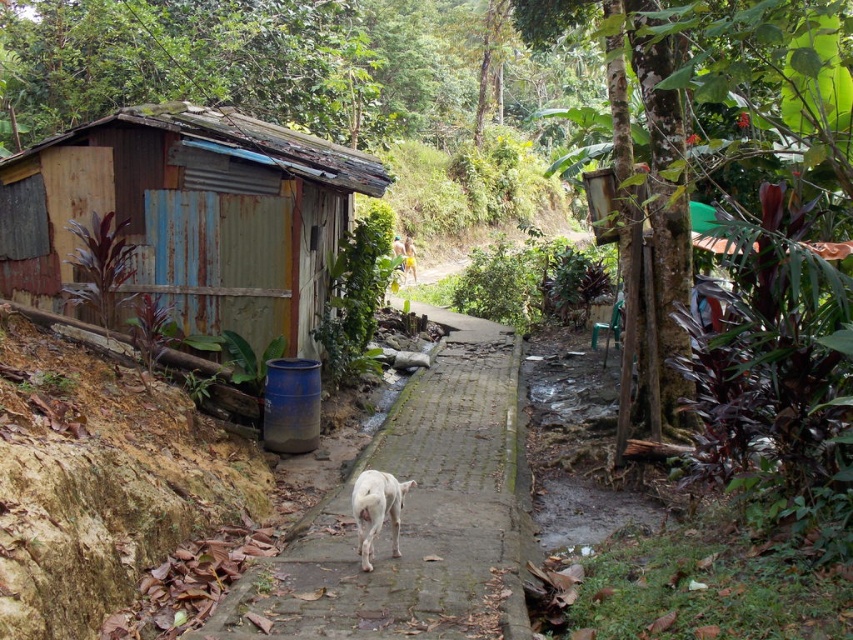
You are a delivery person trying to navigate a narrow path. You see a rusty wood hut at left and a gray concrete pavement at center. Which object is positioned higher in the scene?

The rusty wood hut at left is above the gray concrete pavement at center, so it is positioned higher in the scene.

You are a hiker walking along the narrow pathway in the rural scene. You notice the gray concrete pavement at center and the white fur dog at center. Which object is closer to you as you walk down the path?

The gray concrete pavement at center is in front of the white fur dog at center, so it is closer to you as you walk down the path.

You are a hiker walking along the narrow pathway in the rustic scene. You see the gray concrete pavement at center and the white fur dog at center. Which object is located to the right of the other?

The gray concrete pavement at center is to the right of the white fur dog at center.